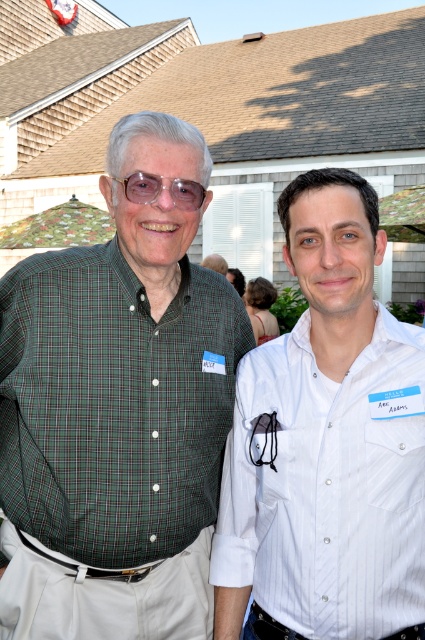
You are at a garden party and see the green plaid shirt at left and the transparent plastic glasses at center. Which item is positioned lower in the image?

The green plaid shirt at left is positioned below the transparent plastic glasses at center, so it is lower in the image.

You are at a party and want to borrow a drink from the person wearing the white pinstripe shirt at center. To hand them the drink, should you aim higher or lower than the transparent plastic glasses at center?

The white pinstripe shirt at center has a larger size compared to transparent plastic glasses at center, so you should aim higher than the transparent plastic glasses at center to hand the drink since the person is taller.